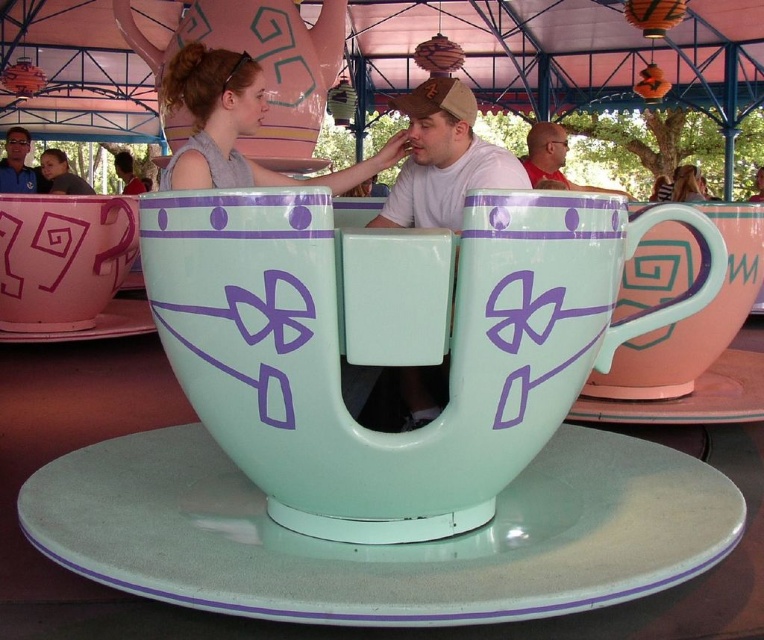
Question: Which object appears farthest from the camera in this image?

Choices:
 (A) matte gray dress at upper center
 (B) glossy ceramic saucer at center
 (C) matte pink mug at left
 (D) matte brown hair at upper left

Answer: (D)

Question: Does matte gray dress at upper center have a smaller size compared to matte pink saucer at lower left?

Choices:
 (A) yes
 (B) no

Answer: (A)

Question: Observing the image, what is the correct spatial positioning of red shirt at upper center in reference to matte gray shirt at upper left?

Choices:
 (A) left
 (B) right

Answer: (B)

Question: Can you confirm if red shirt at upper center is bigger than brushed metal water at upper left?

Choices:
 (A) yes
 (B) no

Answer: (B)

Question: Which object is positioned closest to the matte white cup at center?

Choices:
 (A) mint green ceramic mug at center
 (B) matte pink saucer at lower left
 (C) matte brown hair at upper left

Answer: (A)

Question: Which of these objects is positioned farthest from the matte gray dress at upper center?

Choices:
 (A) glossy ceramic saucer at center
 (B) matte ceramic mug at right
 (C) matte pink saucer at lower left
 (D) matte gray hair at upper center

Answer: (D)